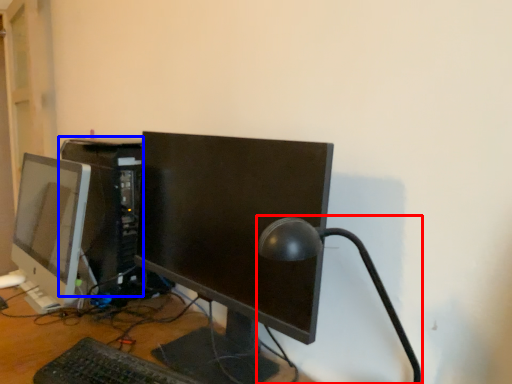
Question: Which point is closer to the camera, table lamp (highlighted by a red box) or computer tower (highlighted by a blue box)?

Choices:
 (A) table lamp
 (B) computer tower

Answer: (A)